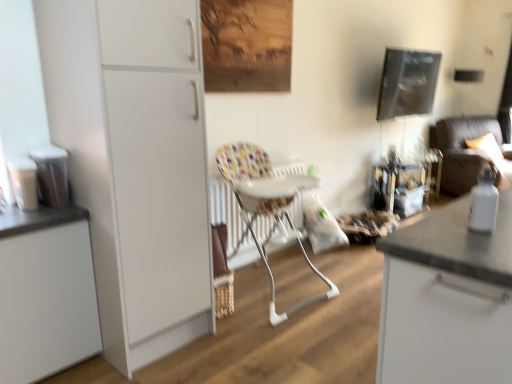
Question: Considering their positions, is white glossy bottle at right located in front of or behind matte plastic containers at left, arranged as the 1th appliance when viewed from the left?

Choices:
 (A) behind
 (B) front

Answer: (B)

Question: From the image's perspective, relative to matte plastic containers at left, arranged as the 2th appliance when viewed from the right, is white glossy bottle at right above or below?

Choices:
 (A) below
 (B) above

Answer: (A)

Question: Which is farther from the matte plastic containers at left, arranged as the 1th appliance when viewed from the left?

Choices:
 (A) white matte cabinet at left, arranged as the 2th cabinetry when viewed from the left
 (B) white glossy bottle at right
 (C) wooden table at right
 (D) printed fabric highchair at center
 (E) metallic reflective picture frame at upper right

Answer: (E)

Question: Which object is the farthest from the printed fabric highchair at center?

Choices:
 (A) white glossy bottle at right
 (B) metallic reflective picture frame at upper right
 (C) white matte cabinet at left, the 1th cabinetry when ordered from right to left
 (D) satin silver trash can at left, the 2th appliance from the left
 (E) dark brown fabric couch at right

Answer: (E)